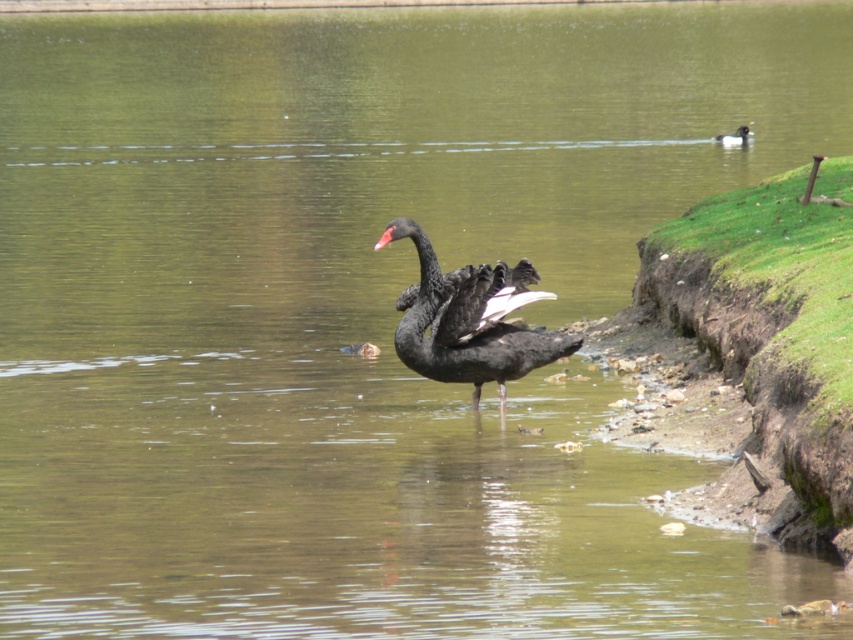
You are a photographer trying to capture the matte black swan at center and the black matte beak at center in a single shot. Since you want both to be clearly visible, which object should you focus on first to ensure clarity?

The matte black swan at center is bigger than the black matte beak at center, so you should focus on the matte black swan at center first to ensure clarity since it is larger and more prominent in the frame.

You are standing at the center of the image and want to locate the matte black swan at center. According to the coordinates provided, in which direction should you look to find it?

The matte black swan at center is located at coordinates point (473, 321). Since you are already at the center, you should look slightly upwards because the y coordinate 0.555 is higher than 0.5, indicating a position above the exact center.